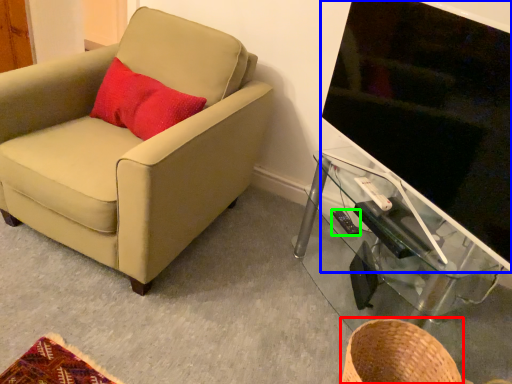
Question: Based on their relative distances, which object is nearer to basket (highlighted by a red box)? Choose from television (highlighted by a blue box) and remote control (highlighted by a green box).

Choices:
 (A) television
 (B) remote control

Answer: (B)